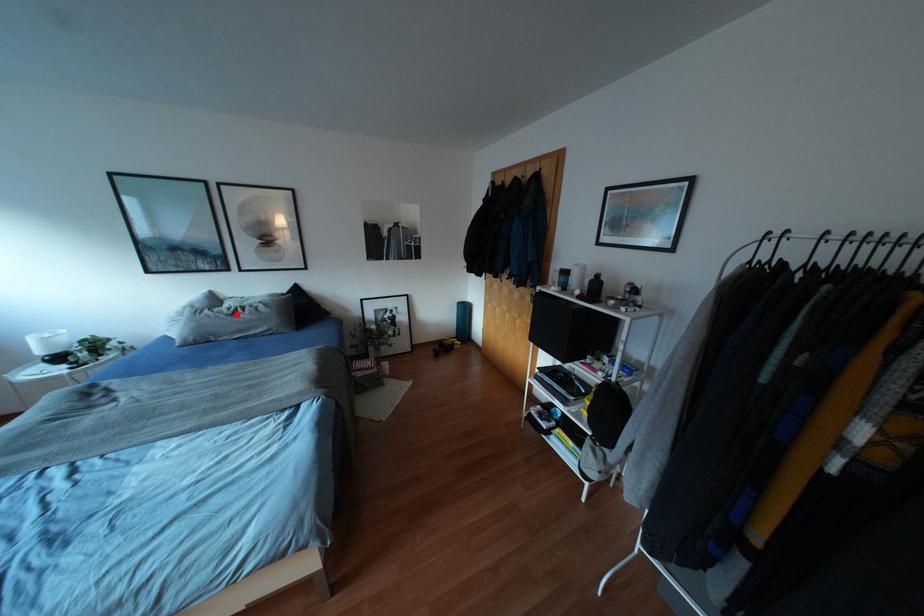
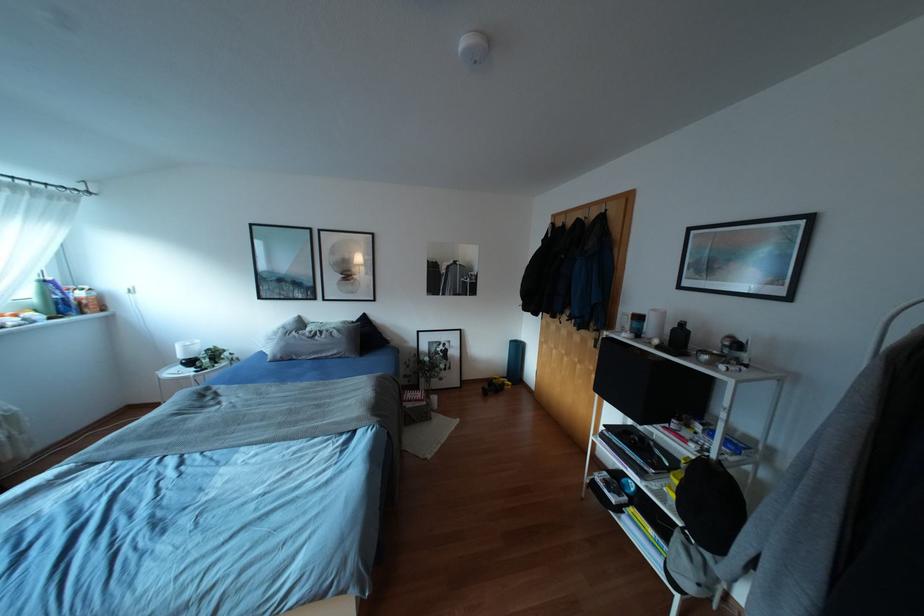
Find the pixel in the second image that matches the highlighted location in the first image.

(315, 338)